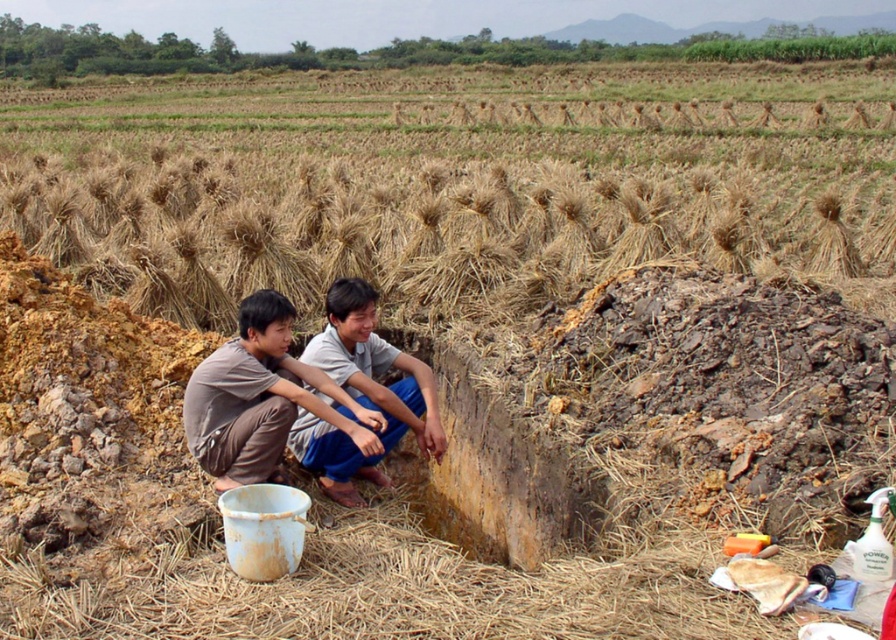
Which is above, brown straw at center or brown fabric squat at center?

brown straw at center is above.

Between brown straw at center and brown fabric squat at center, which one is positioned lower?

brown fabric squat at center is lower down.

Between point (530, 204) and point (389, 429), which one is positioned in front?

Positioned in front is point (389, 429).

Find the location of a particular element. Image resolution: width=896 pixels, height=640 pixels. brown straw at center is located at coordinates (438, 221).

Can you confirm if brown straw at center is thinner than brown cotton shirt at center?

No, brown straw at center is not thinner than brown cotton shirt at center.

Is brown straw at center to the left of brown cotton shirt at center from the viewer's perspective?

Correct, you'll find brown straw at center to the left of brown cotton shirt at center.

Is point (495, 216) positioned behind point (252, 304)?

Yes, it is.

Find the location of a particular element. brown straw at center is located at coordinates (438, 221).

Can you confirm if brown cotton shirt at center is thinner than brown fabric squat at center?

No.

Can you confirm if brown cotton shirt at center is positioned below brown fabric squat at center?

Correct, brown cotton shirt at center is located below brown fabric squat at center.

At what (x,y) coordinates should I click in order to perform the action: click on brown cotton shirt at center. Please return your answer as a coordinate pair (x, y). The width and height of the screenshot is (896, 640). Looking at the image, I should click on (260, 397).